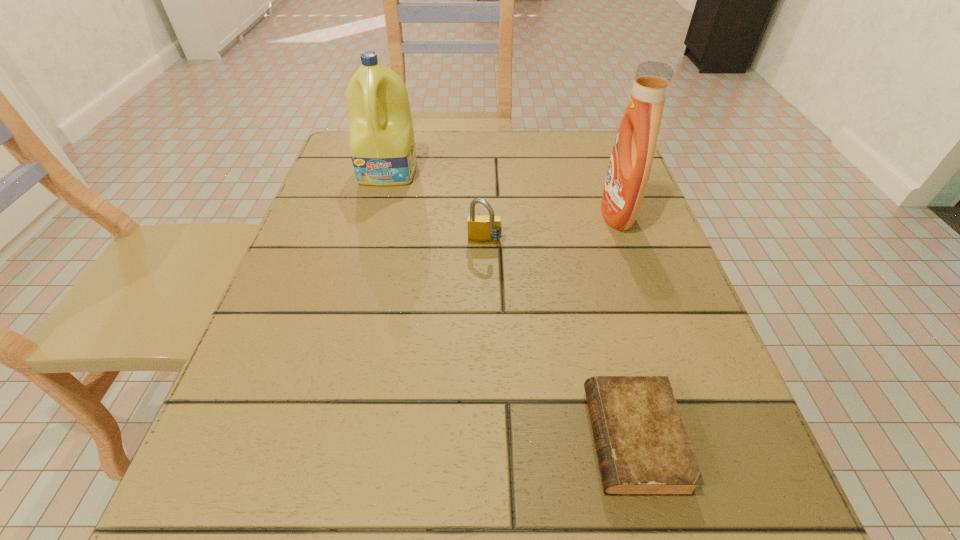
Locate an element on the screen. blank space located on the label of the farther detergent is located at coordinates (356, 299).

This screenshot has height=540, width=960. I want to click on vacant space situated 0.260m on the side with the combination dials of the second object from left to right, so click(x=486, y=370).

The width and height of the screenshot is (960, 540). I want to click on free region located on the spine side of the diary, so click(x=462, y=439).

Where is `vacant position located on the spine side of the diary`? Image resolution: width=960 pixels, height=540 pixels. vacant position located on the spine side of the diary is located at coordinates (446, 439).

You are a GUI agent. You are given a task and a screenshot of the screen. Output one action in this format:
    pyautogui.click(x=<x>, y=<y>)
    Task: Click on the free region located on the spine side of the diary
    
    Given the screenshot: What is the action you would take?
    pyautogui.click(x=356, y=439)

The width and height of the screenshot is (960, 540). In order to click on object that is at the far edge in this screenshot , I will do `click(382, 147)`.

Identify the location of object present at the near edge. The image size is (960, 540). (643, 449).

At what (x,y) coordinates should I click in order to perform the action: click on object located in the left edge section of the desktop. Please return your answer as a coordinate pair (x, y). The height and width of the screenshot is (540, 960). Looking at the image, I should click on (382, 147).

The image size is (960, 540). What are the coordinates of `detergent that is at the right edge` in the screenshot? It's located at (629, 169).

The image size is (960, 540). In order to click on diary situated at the right edge in this screenshot , I will do `click(643, 449)`.